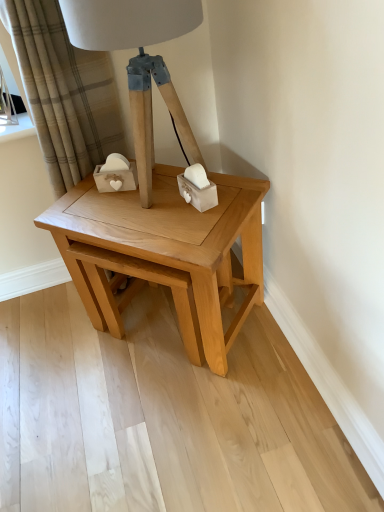
Question: From the image's perspective, is beige plaid curtain at upper left above or below matte wood table lamp at center?

Choices:
 (A) above
 (B) below

Answer: (B)

Question: Does point (16, 31) appear closer or farther from the camera than point (102, 39)?

Choices:
 (A) farther
 (B) closer

Answer: (A)

Question: Which object is positioned farthest from the beige plaid curtain at upper left?

Choices:
 (A) natural wood table at center
 (B) matte wood table lamp at center

Answer: (A)

Question: Based on their relative distances, which object is farther from the beige plaid curtain at upper left?

Choices:
 (A) natural wood table at center
 (B) matte wood table lamp at center

Answer: (A)